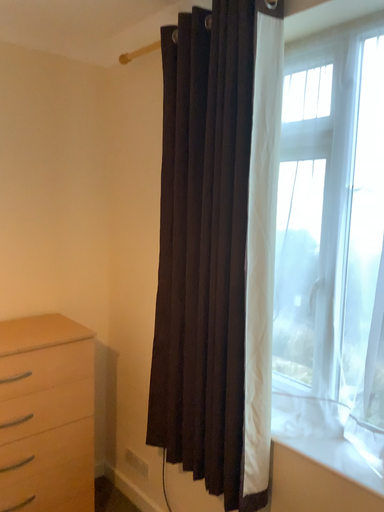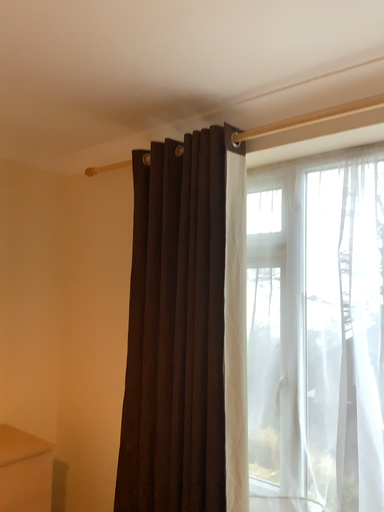
Question: How did the camera likely rotate when shooting the video?

Choices:
 (A) rotated left
 (B) rotated right

Answer: (B)